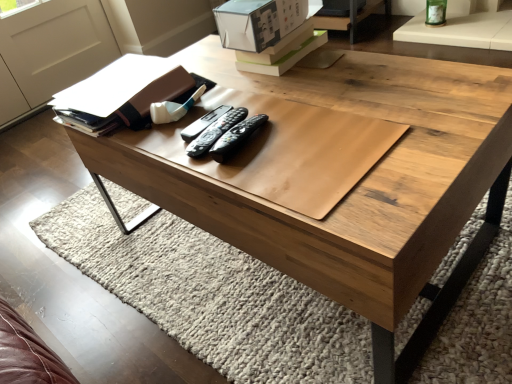
At what (x,y) coordinates should I click in order to perform the action: click on vacant area that is in front of black plastic remote at center, marked as the 2th remote in a right-to-left arrangement. Please return your answer as a coordinate pair (x, y). Looking at the image, I should click on (254, 178).